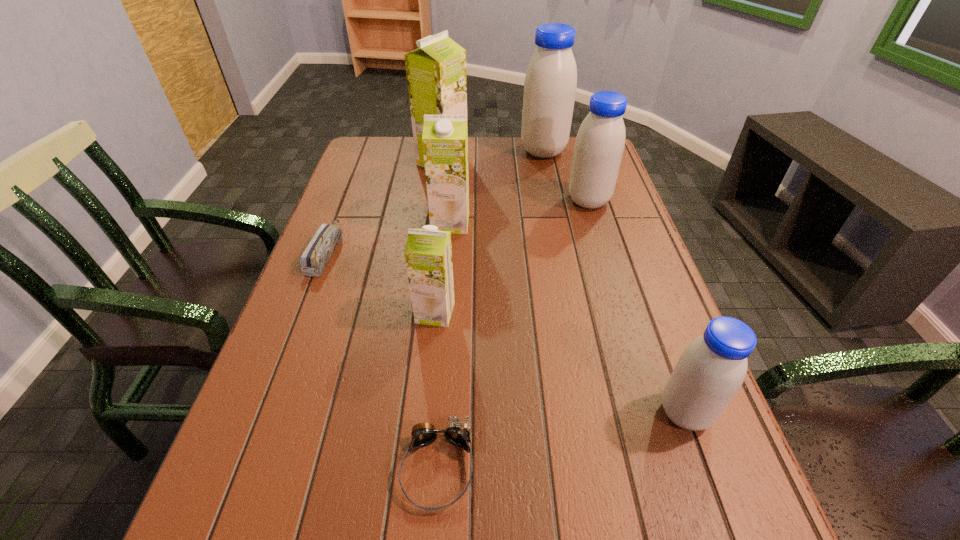
Find the location of a particular element. This screenshot has height=540, width=960. vacant space positioned 0.290m on the front of the biggest blue soya milk is located at coordinates click(x=557, y=217).

Identify the location of blank area located on the back of the farthest green soya milk. This screenshot has width=960, height=540. (444, 142).

The image size is (960, 540). Find the location of `free space located 0.180m on the front of the second nearest green soya milk`. free space located 0.180m on the front of the second nearest green soya milk is located at coordinates (445, 282).

What are the coordinates of `blank area located on the left of the second smallest blue soya milk` in the screenshot? It's located at (430, 201).

Where is `free space located 0.370m on the front of the nearest green soya milk`? The height and width of the screenshot is (540, 960). free space located 0.370m on the front of the nearest green soya milk is located at coordinates (416, 518).

This screenshot has height=540, width=960. Identify the location of vacant space located 0.150m on the back of the smallest blue soya milk. (654, 327).

Where is `free location located on the right of the pencil box`? This screenshot has height=540, width=960. free location located on the right of the pencil box is located at coordinates (439, 252).

Image resolution: width=960 pixels, height=540 pixels. In order to click on object present at the left edge in this screenshot , I will do `click(319, 251)`.

I want to click on object that is at the far right corner, so click(550, 84).

Locate an element on the screen. This screenshot has height=540, width=960. vacant space at the left edge of the desktop is located at coordinates (354, 334).